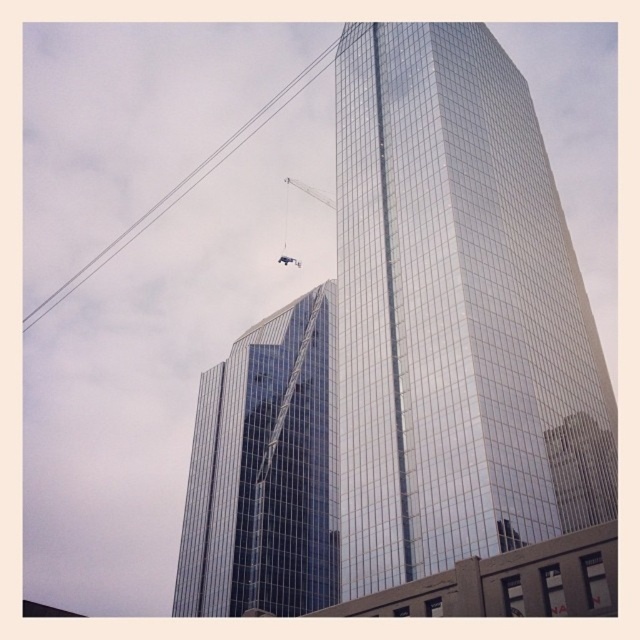
You are a drone operator trying to navigate between two points in the urban scene. You need to fly from point A to point B. If point A is point (x=321, y=61) and point B is point (x=285, y=186), which point is closer to you as you start your flight?

Point A, which is point (x=321, y=61), is closer to you because it is further to the viewer than point B, point (x=285, y=186).

You are a city planner reviewing the urban layout. You need to determine the visibility of the metallic silver crane at upper center from the street level. Considering the presence of the glossy glass tower at center, would the crane be partially or fully visible?

The glossy glass tower at center is in front of the metallic silver crane at upper center, so the crane would be partially hidden by the tower and thus only partially visible from the street level.

You are a drone operator trying to navigate a delivery drone through the urban area. The drone must avoid obstacles and fly along a specific path. The path starts at the black wire at upper left and ends at the point with coordinates 0.5, 0.5. Is the starting point of the path located to the left or right of the ending point?

The starting point of the path is located to the left of the ending point because the black wire at upper left is at point (186, 182), which is to the left of (320, 320).